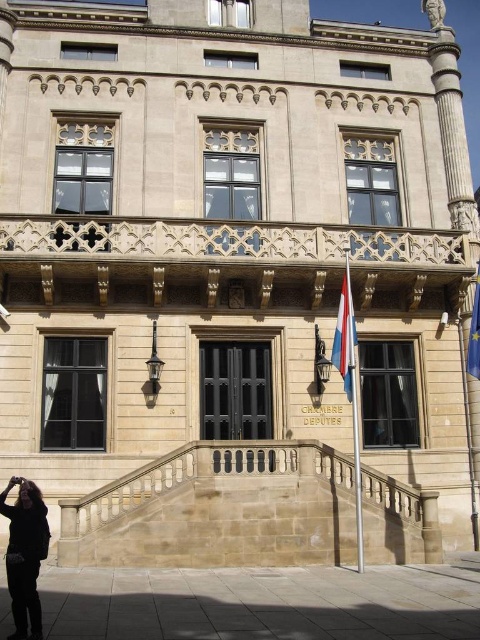
In the scene shown: You are a visitor standing at the entrance of the historic building. You see a dark brown fur coat at lower left and a blue fabric flag at right. Which object is closer to you?

The dark brown fur coat at lower left is closer to you because it is in front of the blue fabric flag at right.

You are an architect assessing the building facade. You need to install a new light fixture between the stone balustrade at center and the polished fabric flag at center. Which object should the light fixture be placed below to ensure it is visible from the ground floor?

The light fixture should be placed below the polished fabric flag at center because it is taller than the stone balustrade at center, ensuring visibility from the ground floor.